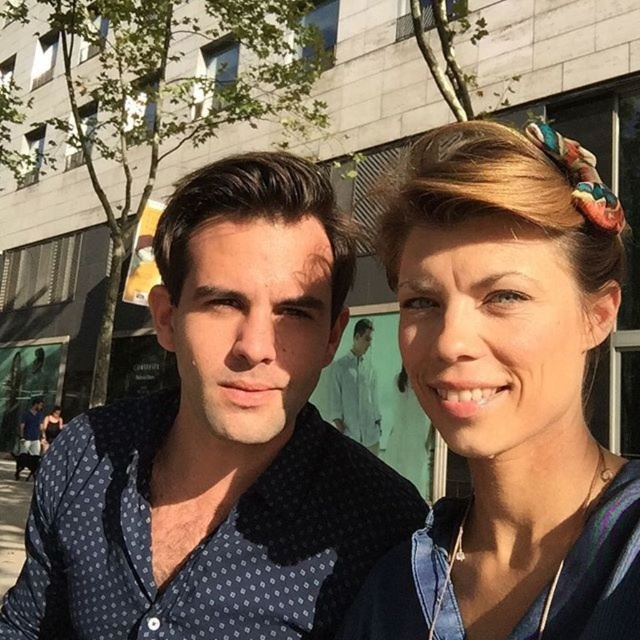
Question: Which point is closer to the camera taking this photo?

Choices:
 (A) (250, 205)
 (B) (342, 419)

Answer: (A)

Question: Can you confirm if blue fabric headband at upper right is positioned below white smooth shirt at center?

Choices:
 (A) no
 (B) yes

Answer: (A)

Question: Considering the real-world distances, which object is closest to the white smooth shirt at center?

Choices:
 (A) blue dotted shirt at center
 (B) blue fabric headband at upper right

Answer: (A)

Question: Which of these objects is positioned closest to the white smooth shirt at center?

Choices:
 (A) blue fabric headband at upper right
 (B) blue dotted shirt at center

Answer: (B)

Question: Can you confirm if blue dotted shirt at center is positioned below blue fabric headband at upper right?

Choices:
 (A) no
 (B) yes

Answer: (B)

Question: Can you confirm if blue fabric headband at upper right is positioned to the left of white smooth shirt at center?

Choices:
 (A) no
 (B) yes

Answer: (B)